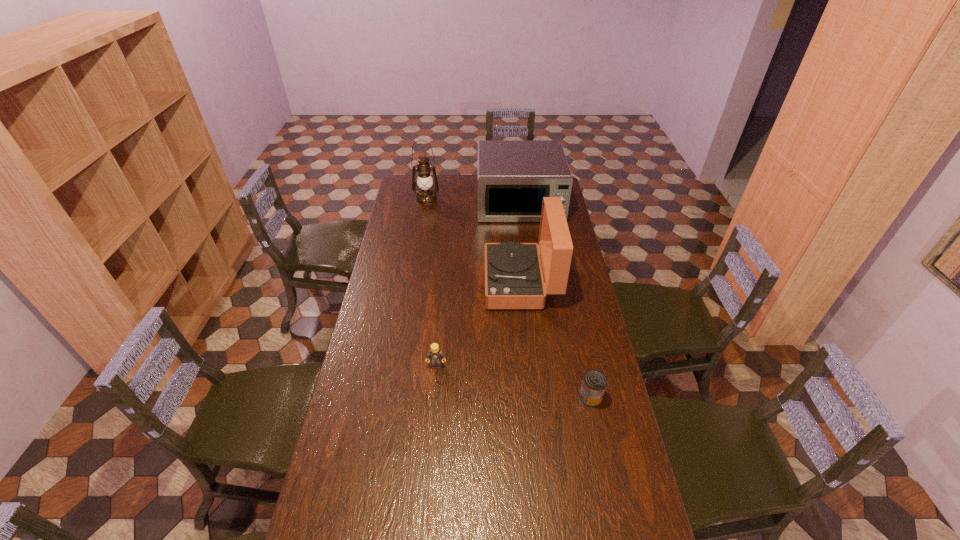
The image size is (960, 540). Identify the location of vacant region located 0.140m on the face of the third nearest object. (452, 282).

I want to click on free space located with the door open on the third tallest object, so click(528, 271).

Find the location of a particular element. This screenshot has width=960, height=540. free space located in front of the second nearest object is located at coordinates click(429, 444).

At what (x,y) coordinates should I click in order to perform the action: click on vacant space located 0.150m on the front of the nearest object. Please return your answer as a coordinate pair (x, y). Looking at the image, I should click on (602, 450).

Identify the location of oil lamp situated at the far edge. (426, 195).

Locate an element on the screen. The height and width of the screenshot is (540, 960). microwave oven that is at the far edge is located at coordinates (513, 175).

Find the location of `object at the left edge`. object at the left edge is located at coordinates (426, 195).

Identify the location of phonograph record that is positioned at the right edge. The image size is (960, 540). (513, 278).

Find the location of a particular element. This screenshot has height=540, width=960. microwave oven located at the right edge is located at coordinates (513, 175).

Identify the location of can that is at the right edge. This screenshot has height=540, width=960. (594, 383).